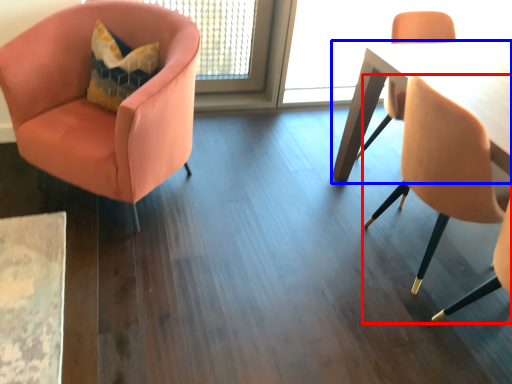
Question: Which object appears farthest to the camera in this image, chair (highlighted by a red box) or table (highlighted by a blue box)?

Choices:
 (A) chair
 (B) table

Answer: (B)